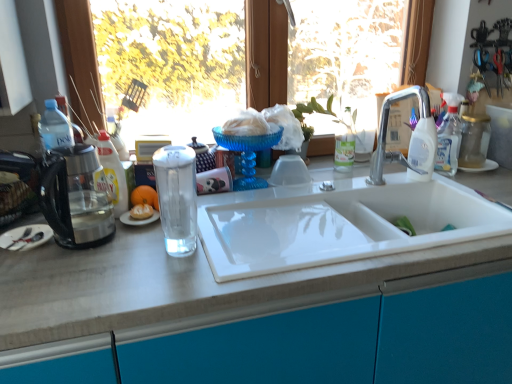
Identify the location of vacant area that lies between translucent glass kettle at left and clear glass water at center. The width and height of the screenshot is (512, 384). (119, 253).